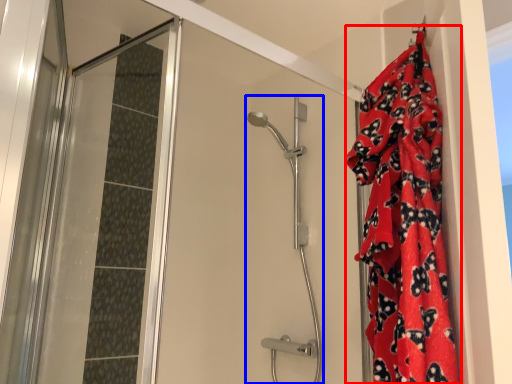
Question: Which object is closer to the camera taking this photo, blanket (highlighted by a red box) or shower door (highlighted by a blue box)?

Choices:
 (A) blanket
 (B) shower door

Answer: (A)